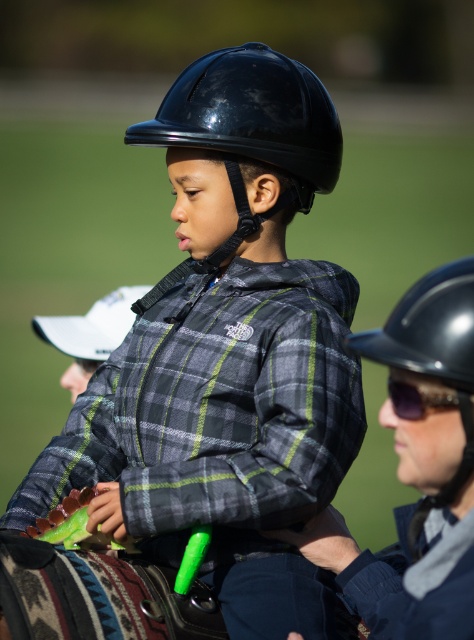
Question: Does matte black helmet at center have a greater width compared to black hard helmet at center?

Choices:
 (A) no
 (B) yes

Answer: (B)

Question: Does matte black helmet at center appear under black glossy helmet at center?

Choices:
 (A) yes
 (B) no

Answer: (A)

Question: Is black hard helmet at center thinner than sunglasses at center?

Choices:
 (A) yes
 (B) no

Answer: (B)

Question: Which of the following is the closest to the observer?

Choices:
 (A) (309, 170)
 (B) (390, 381)

Answer: (B)

Question: Which object appears farthest from the camera in this image?

Choices:
 (A) black hard helmet at center
 (B) black glossy helmet at center
 (C) sunglasses at center
 (D) matte black helmet at center

Answer: (B)

Question: Which of the following is the closest to the observer?

Choices:
 (A) (457, 304)
 (B) (394, 394)
 (C) (12, 522)

Answer: (A)